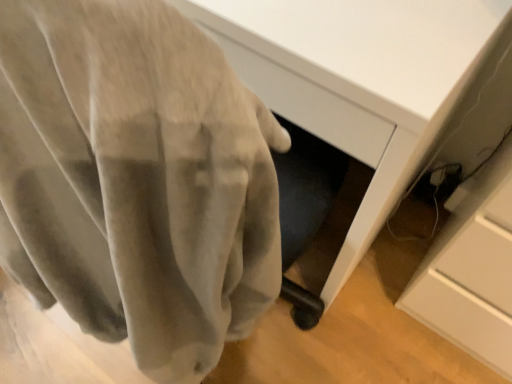
Locate an element on the screen. This screenshot has width=512, height=384. velvet gray curtain at center is located at coordinates (136, 179).

What do you see at coordinates (136, 179) in the screenshot? The image size is (512, 384). I see `velvet gray curtain at center` at bounding box center [136, 179].

Measure the distance between matte white desk at center and camera.

matte white desk at center and camera are 19.43 inches apart from each other.

The image size is (512, 384). What do you see at coordinates (370, 102) in the screenshot?
I see `matte white desk at center` at bounding box center [370, 102].

At what (x,y) coordinates should I click in order to perform the action: click on matte white desk at center. Please return your answer as a coordinate pair (x, y). This screenshot has width=512, height=384. Looking at the image, I should click on (370, 102).

The height and width of the screenshot is (384, 512). In order to click on velvet gray curtain at center in this screenshot , I will do `click(136, 179)`.

Does matte white desk at center appear on the right side of velvet gray curtain at center?

Correct, you'll find matte white desk at center to the right of velvet gray curtain at center.

Does matte white desk at center lie in front of velvet gray curtain at center?

No, it is not.

Between point (346, 246) and point (10, 107), which one is positioned in front?

The point (10, 107) is closer.

From the image's perspective, is matte white desk at center above velvet gray curtain at center?

Correct, matte white desk at center appears higher than velvet gray curtain at center in the image.

From a real-world perspective, which object rests below the other?

matte white desk at center, from a real-world perspective.

Which object is thinner, matte white desk at center or velvet gray curtain at center?

Thinner between the two is velvet gray curtain at center.

Is matte white desk at center taller than velvet gray curtain at center?

Correct, matte white desk at center is much taller as velvet gray curtain at center.

Does matte white desk at center have a larger size compared to velvet gray curtain at center?

Yes, matte white desk at center is bigger than velvet gray curtain at center.

Does matte white desk at center contain velvet gray curtain at center?

No, matte white desk at center does not contain velvet gray curtain at center.

Are matte white desk at center and velvet gray curtain at center making contact?

No, matte white desk at center is not with velvet gray curtain at center.

Is matte white desk at center turned away from velvet gray curtain at center?

No, matte white desk at center is not facing away from velvet gray curtain at center.

How different are the orientations of matte white desk at center and velvet gray curtain at center in degrees?

172 degrees separate the facing orientations of matte white desk at center and velvet gray curtain at center.

This screenshot has height=384, width=512. In order to click on curtain to the left of matte white desk at center in this screenshot , I will do `click(136, 179)`.

Is velvet gray curtain at center to the left or to the right of matte white desk at center in the image?

In the image, velvet gray curtain at center appears on the left side of matte white desk at center.

Considering the positions of objects velvet gray curtain at center and matte white desk at center in the image provided, who is behind, velvet gray curtain at center or matte white desk at center?

Positioned behind is matte white desk at center.

Based on the photo, which is more distant, (x=158, y=7) or (x=352, y=131)?

The point (x=352, y=131) is more distant.

From the image's perspective, which is above, velvet gray curtain at center or matte white desk at center?

matte white desk at center, from the image's perspective.

From a real-world perspective, is velvet gray curtain at center located beneath matte white desk at center?

Incorrect, from a real-world perspective, velvet gray curtain at center is higher than matte white desk at center.

Can you confirm if velvet gray curtain at center is wider than matte white desk at center?

In fact, velvet gray curtain at center might be narrower than matte white desk at center.

Between velvet gray curtain at center and matte white desk at center, which one has more height?

With more height is matte white desk at center.

Between velvet gray curtain at center and matte white desk at center, which one has smaller size?

With smaller size is velvet gray curtain at center.

Is velvet gray curtain at center outside of matte white desk at center?

Yes, velvet gray curtain at center is outside of matte white desk at center.

Is there a large distance between velvet gray curtain at center and matte white desk at center?

Actually, velvet gray curtain at center and matte white desk at center are a little close together.

Is matte white desk at center at the back of velvet gray curtain at center?

No, matte white desk at center is not at the back of velvet gray curtain at center.

How different are the orientations of velvet gray curtain at center and matte white desk at center in degrees?

velvet gray curtain at center and matte white desk at center are facing 172 degrees away from each other.

This screenshot has height=384, width=512. In order to click on desk below the velvet gray curtain at center (from a real-world perspective) in this screenshot , I will do `click(370, 102)`.

In order to click on curtain below the matte white desk at center (from the image's perspective) in this screenshot , I will do tap(136, 179).

Locate an element on the screen. This screenshot has width=512, height=384. curtain above the matte white desk at center (from a real-world perspective) is located at coordinates (136, 179).